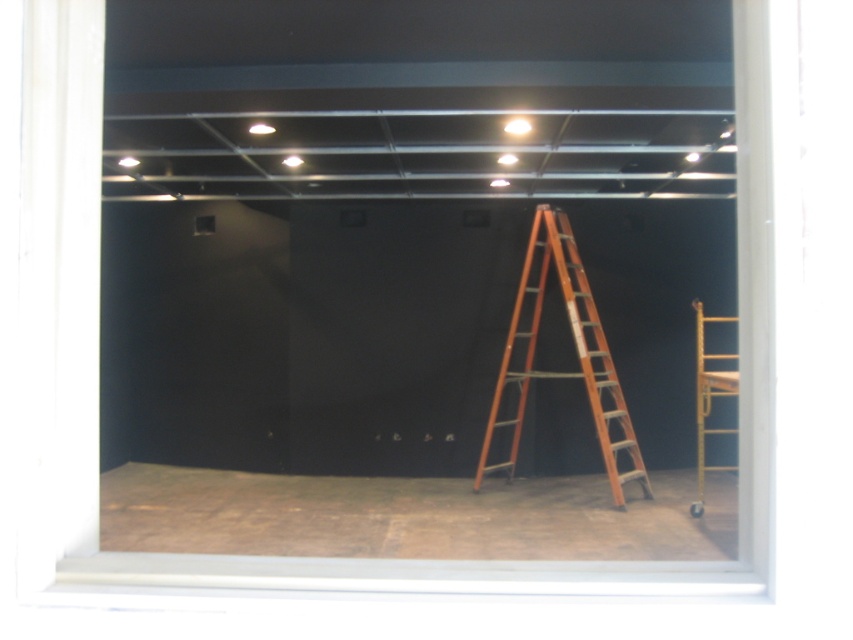
Question: Which of the following is the closest to the observer?

Choices:
 (A) (280, 513)
 (B) (578, 300)

Answer: (A)

Question: Can you confirm if brown wood floor at lower center is positioned to the right of wooden ladder at center?

Choices:
 (A) no
 (B) yes

Answer: (A)

Question: Among these objects, which one is farthest from the camera?

Choices:
 (A) brown wood floor at lower center
 (B) wooden ladder at center

Answer: (B)

Question: Can you confirm if brown wood floor at lower center is smaller than wooden ladder at center?

Choices:
 (A) no
 (B) yes

Answer: (B)

Question: Which point appears farthest from the camera in this image?

Choices:
 (A) (491, 506)
 (B) (636, 456)

Answer: (B)

Question: Is brown wood floor at lower center below wooden ladder at center?

Choices:
 (A) no
 (B) yes

Answer: (B)